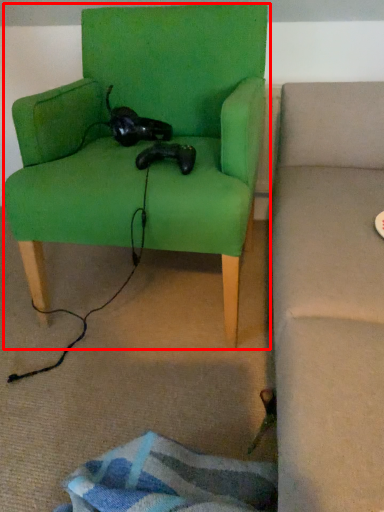
Question: From the image's perspective, where is chair (annotated by the red box) located relative to animal?

Choices:
 (A) below
 (B) above

Answer: (B)